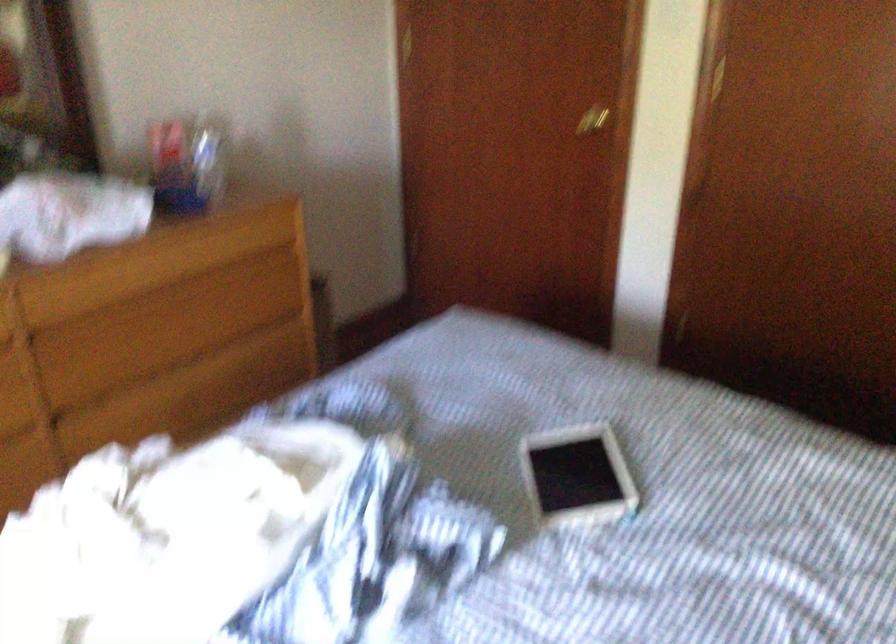
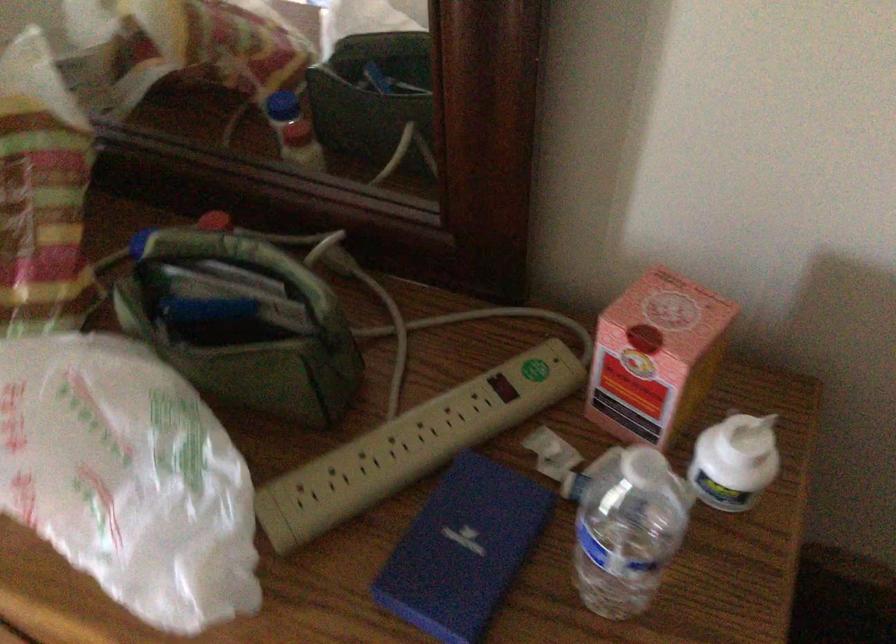
Locate, in the second image, the point that corresponds to pixel 207 152 in the first image.

(754, 435)